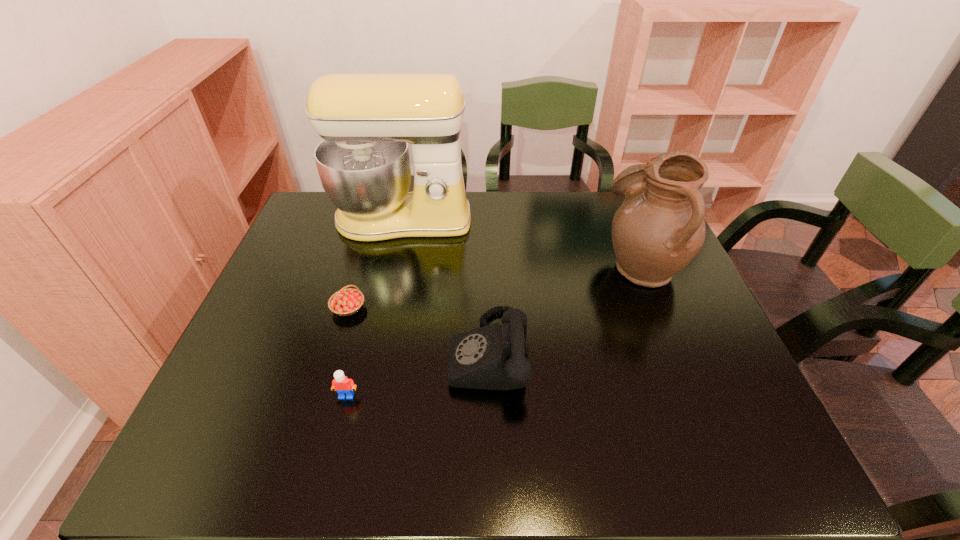
Where is `vacant region located 0.280m on the dial of the third shortest object`? The height and width of the screenshot is (540, 960). vacant region located 0.280m on the dial of the third shortest object is located at coordinates tap(328, 353).

Where is `vacant space located 0.380m on the dial of the third shortest object`? Image resolution: width=960 pixels, height=540 pixels. vacant space located 0.380m on the dial of the third shortest object is located at coordinates (285, 353).

Where is `vacant space located 0.220m on the dial of the third shortest object`? The height and width of the screenshot is (540, 960). vacant space located 0.220m on the dial of the third shortest object is located at coordinates (355, 353).

I want to click on vacant area situated on the face of the second shortest object, so click(x=336, y=436).

Locate an element on the screen. This screenshot has width=960, height=540. free location located 0.370m on the back of the strawberry is located at coordinates (376, 214).

Find the location of a particular element. The height and width of the screenshot is (540, 960). mixer that is at the far edge is located at coordinates (366, 120).

I want to click on pitcher located in the far edge section of the desktop, so click(x=659, y=228).

The image size is (960, 540). Identify the location of object present at the left edge. (366, 120).

Locate an element on the screen. The height and width of the screenshot is (540, 960). object that is at the right edge is located at coordinates (659, 228).

You are a GUI agent. You are given a task and a screenshot of the screen. Output one action in this format:
    pyautogui.click(x=<x>, y=<y>)
    Task: Click on the object present at the far left corner
    
    Given the screenshot: What is the action you would take?
    pyautogui.click(x=366, y=120)